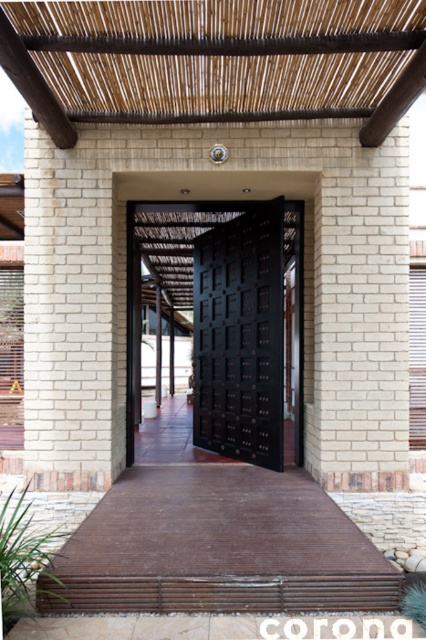
Does white brick pillar at center have a smaller size compared to black matte door at center?

Indeed, white brick pillar at center has a smaller size compared to black matte door at center.

Does point (310, 348) come farther from viewer compared to point (259, 321)?

No, it is not.

The image size is (426, 640). Find the location of `white brick pillar at center`. white brick pillar at center is located at coordinates (359, 316).

Which is in front, point (89, 337) or point (215, 262)?

Point (89, 337) is more forward.

Does white brick pillar at left appear under black matte door at center?

Actually, white brick pillar at left is above black matte door at center.

Between point (62, 269) and point (270, 227), which one is positioned behind?

Point (270, 227)

Locate an element on the screen. The width and height of the screenshot is (426, 640). white brick pillar at left is located at coordinates (72, 316).

Is white brick pillar at center above white brick pillar at left?

Incorrect, white brick pillar at center is not positioned above white brick pillar at left.

Is white brick pillar at center shorter than white brick pillar at left?

Correct, white brick pillar at center is not as tall as white brick pillar at left.

Between point (354, 220) and point (54, 467), which one is positioned in front?

Positioned in front is point (54, 467).

What are the coordinates of `white brick pillar at center` in the screenshot? It's located at (359, 316).